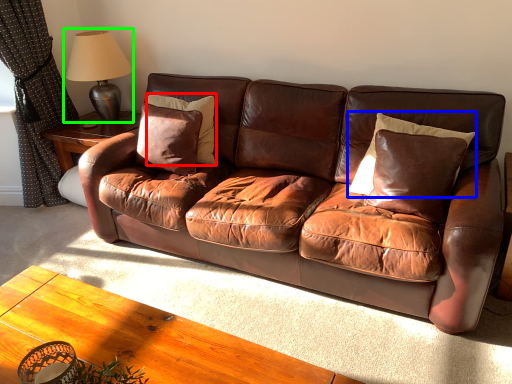
Question: Estimate the real-world distances between objects in this image. Which object is closer to pillow (highlighted by a red box), pillow (highlighted by a blue box) or table lamp (highlighted by a green box)?

Choices:
 (A) pillow
 (B) table lamp

Answer: (B)